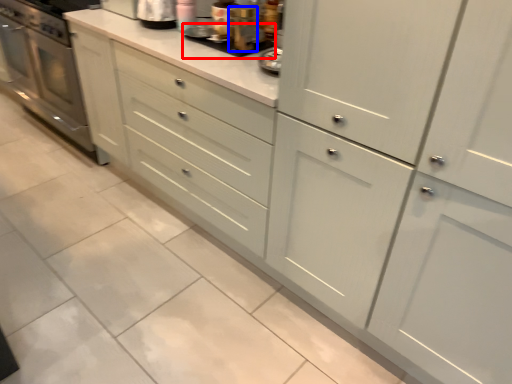
Question: Which object appears farthest to the camera in this image, appliance (highlighted by a red box) or appliance (highlighted by a blue box)?

Choices:
 (A) appliance
 (B) appliance

Answer: (A)